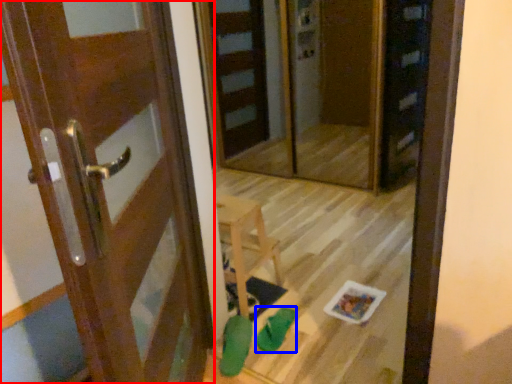
Question: Which object appears closest to the camera in this image, door (highlighted by a red box) or shoe (highlighted by a blue box)?

Choices:
 (A) door
 (B) shoe

Answer: (A)